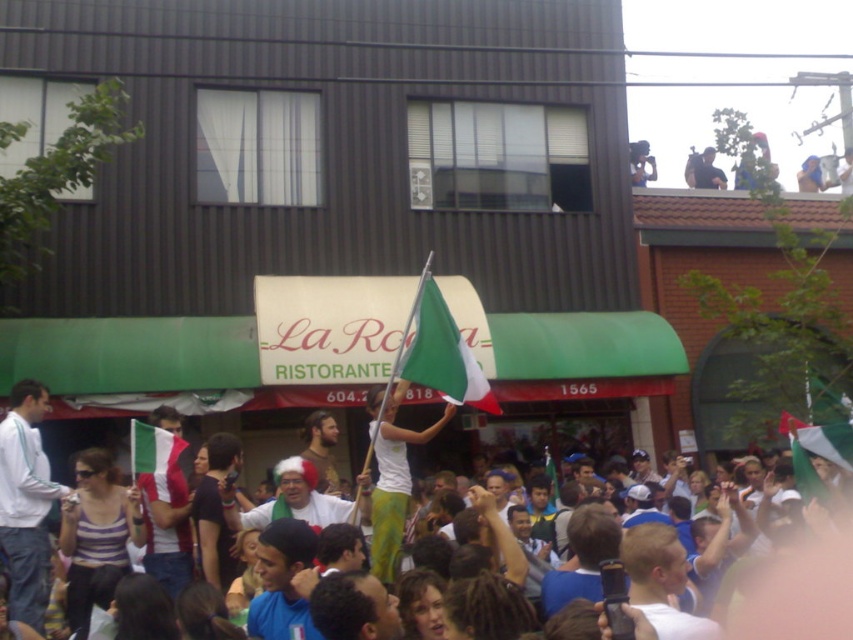
Question: Among these objects, which one is farthest from the camera?

Choices:
 (A) green-white-red fabric flag at center
 (B) metallic silver camera at upper right
 (C) matte fabric flag at center

Answer: (B)

Question: Can you confirm if green fabric flag at center is thinner than green-white-red fabric flag at center?

Choices:
 (A) yes
 (B) no

Answer: (B)

Question: Is white cotton shirt at left smaller than green-white-red fabric flag at center?

Choices:
 (A) yes
 (B) no

Answer: (B)

Question: Which object is farther from the camera taking this photo?

Choices:
 (A) white matte flag at center
 (B) green-white-red fabric flag at center
 (C) metallic silver camera at upper right

Answer: (C)

Question: Estimate the real-world distances between objects in this image. Which object is closer to the green-white-red fabric flag at center?

Choices:
 (A) dark blue shirt at upper center
 (B) matte fabric flag at center
 (C) white matte flag at center

Answer: (C)

Question: Can you confirm if white cotton shirt at left is positioned to the right of matte fabric flag at center?

Choices:
 (A) yes
 (B) no

Answer: (B)